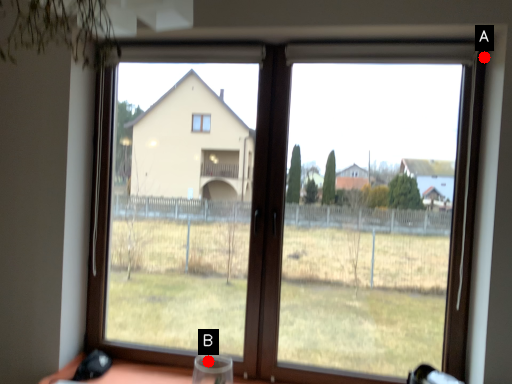
Question: Two points are circled on the image, labeled by A and B beside each circle. Which point is farther to the camera?

Choices:
 (A) A is further
 (B) B is further

Answer: (B)